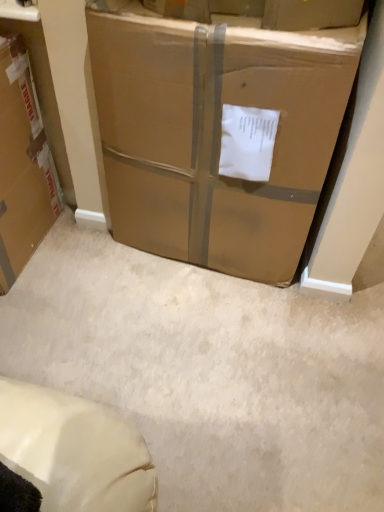
Where is `free space in front of brown cardboard box at center, which is the 1th box in right-to-left order`? This screenshot has height=512, width=384. free space in front of brown cardboard box at center, which is the 1th box in right-to-left order is located at coordinates pyautogui.click(x=210, y=346).